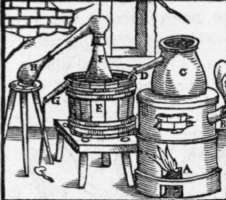
What are the coordinates of `stool` in the screenshot? It's located at (14, 89).